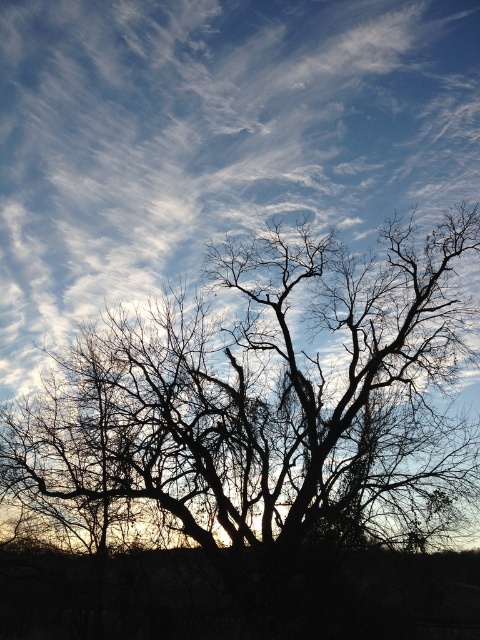
Is white cotton cloud at upper center smaller than silhouette bark tree at center?

Indeed, white cotton cloud at upper center has a smaller size compared to silhouette bark tree at center.

Looking at this image, is white cotton cloud at upper center to the right of silhouette bark tree at center from the viewer's perspective?

Incorrect, white cotton cloud at upper center is not on the right side of silhouette bark tree at center.

Describe the element at coordinates (213, 138) in the screenshot. I see `white cotton cloud at upper center` at that location.

At what (x,y) coordinates should I click in order to perform the action: click on white cotton cloud at upper center. Please return your answer as a coordinate pair (x, y). Looking at the image, I should click on (213, 138).